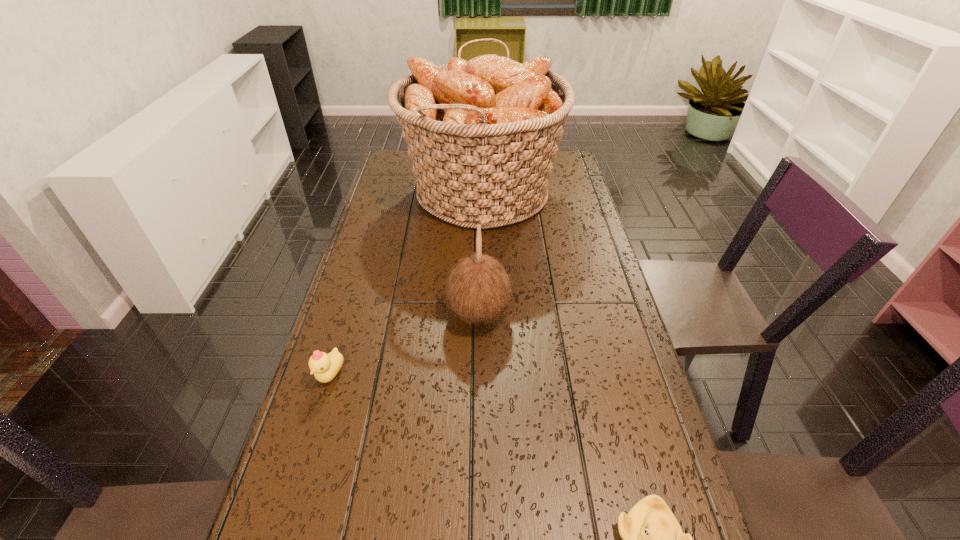
The image size is (960, 540). I want to click on the tallest object, so click(x=483, y=134).

What are the coordinates of `the farthest object` in the screenshot? It's located at (483, 134).

You are a GUI agent. You are given a task and a screenshot of the screen. Output one action in this format:
    pyautogui.click(x=<x>, y=<y>)
    Task: Click on the third shortest object
    This screenshot has height=540, width=960.
    Given the screenshot: What is the action you would take?
    pyautogui.click(x=479, y=289)

Locate an element on the screen. Image resolution: width=960 pixels, height=540 pixels. the second farthest object is located at coordinates (479, 289).

The height and width of the screenshot is (540, 960). Identify the location of the farther duckling. (325, 367).

Where is `the left duckling`? the left duckling is located at coordinates (325, 367).

At what (x,y) coordinates should I click in order to perform the action: click on vacant space located on the front of the farthest object. Please return your answer as a coordinate pair (x, y). The height and width of the screenshot is (540, 960). Looking at the image, I should click on (x=482, y=292).

Find the location of a particular element. The width and height of the screenshot is (960, 540). free space located 0.290m on the surface of the coconut is located at coordinates (624, 314).

Identify the location of free location located on the front-facing side of the third farthest object. The height and width of the screenshot is (540, 960). (x=298, y=483).

This screenshot has height=540, width=960. What are the coordinates of `object that is at the far edge` in the screenshot? It's located at (483, 134).